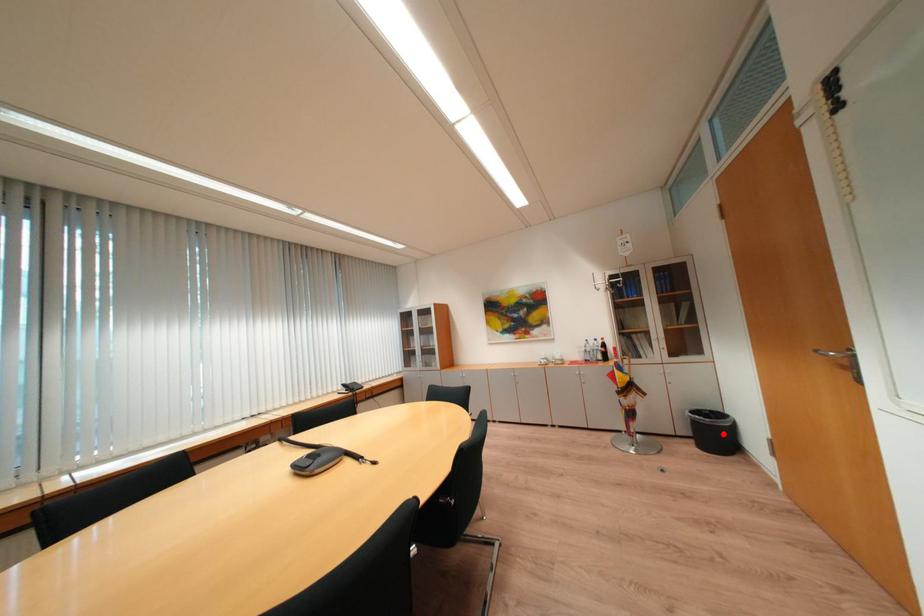
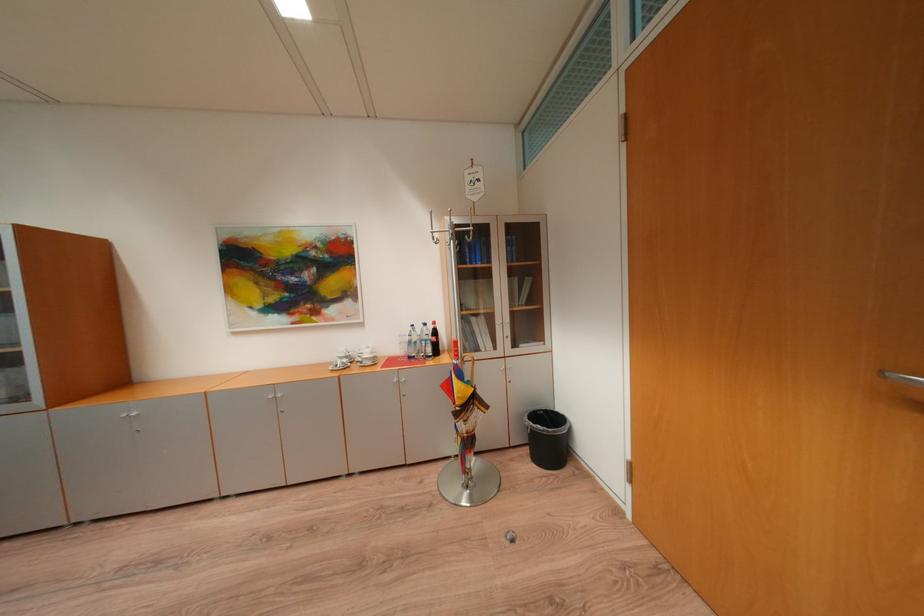
Question: I am providing you with two images of the same scene from different viewpoints. A red point is marked on the first image. At the location where the point appears in image 1, is it still visible in image 2?

Choices:
 (A) Yes
 (B) No

Answer: (A)